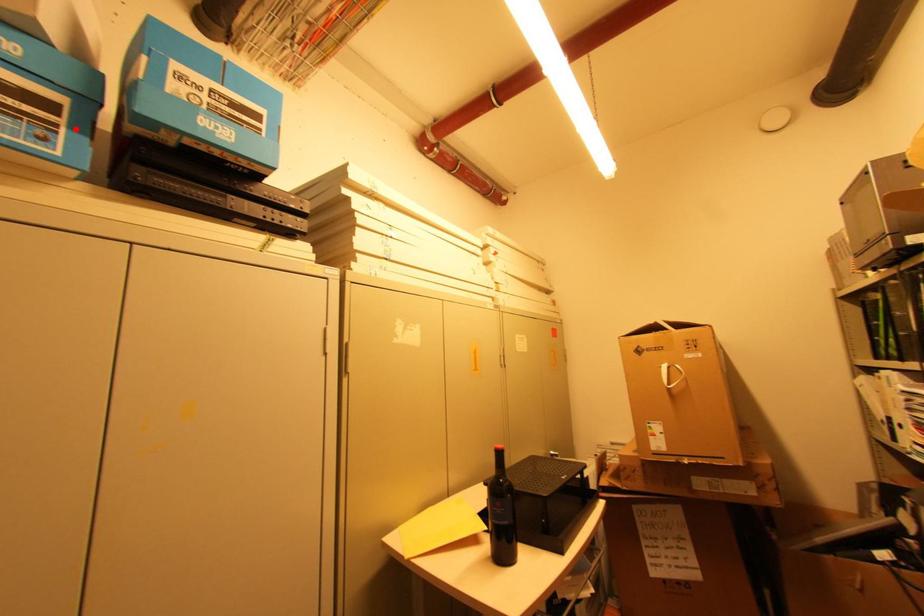
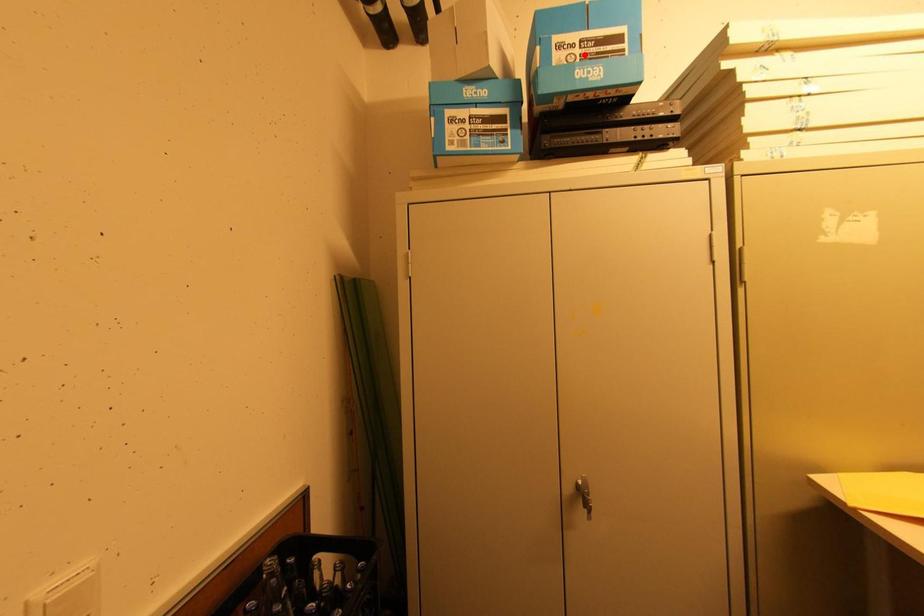
I am providing you with two images of the same scene from different viewpoints. A red point is marked on the first image and another point is marked on the second image. Is the marked point in image1 the same physical position as the marked point in image2?

No